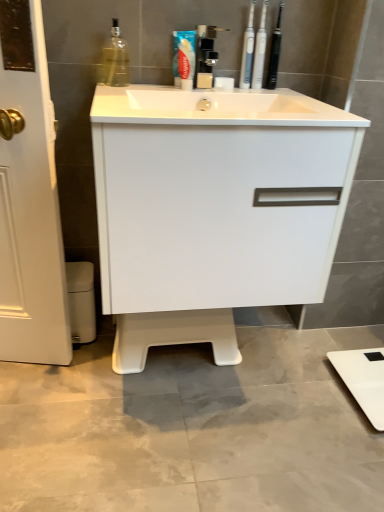
What is the approximate height of white glossy cabinet at center?

The height of white glossy cabinet at center is 22.76 inches.

Describe the element at coordinates (214, 209) in the screenshot. I see `white glossy cabinet at center` at that location.

The height and width of the screenshot is (512, 384). What do you see at coordinates (205, 55) in the screenshot?
I see `satin nickel faucet at upper center` at bounding box center [205, 55].

Describe the element at coordinates (275, 52) in the screenshot. The width and height of the screenshot is (384, 512). I see `black plastic toothbrushes at upper center, the first toiletry when ordered from right to left` at that location.

The image size is (384, 512). What do you see at coordinates (260, 50) in the screenshot?
I see `white plastic toothbrushes at upper center, which is the second toiletry in left-to-right order` at bounding box center [260, 50].

This screenshot has width=384, height=512. What do you see at coordinates (115, 59) in the screenshot? I see `translucent glass bottle at upper left` at bounding box center [115, 59].

The image size is (384, 512). Find the location of `white glossy sink at center`. white glossy sink at center is located at coordinates (215, 108).

Does white plastic toothbrushes at upper center, which is the second toiletry in left-to-right order, contain satin nickel faucet at upper center?

Definitely not — satin nickel faucet at upper center is not inside white plastic toothbrushes at upper center, which is the second toiletry in left-to-right order.

In the scene shown: Is white plastic toothbrushes at upper center, which is the second toiletry in left-to-right order, positioned far away from satin nickel faucet at upper center?

No.

From a real-world perspective, between white plastic toothbrushes at upper center, which is the second toiletry in left-to-right order, and satin nickel faucet at upper center, who is vertically lower?

satin nickel faucet at upper center, from a real-world perspective.

Considering the relative sizes of white plastic toothbrushes at upper center, which is the second toiletry in left-to-right order, and satin nickel faucet at upper center in the image provided, is white plastic toothbrushes at upper center, which is the second toiletry in left-to-right order, smaller than satin nickel faucet at upper center?

Indeed, white plastic toothbrushes at upper center, which is the second toiletry in left-to-right order, has a smaller size compared to satin nickel faucet at upper center.

Is white glossy sink at center aimed at white plastic toothbrushes at upper center, the 2th toiletry in the right-to-left sequence?

No, white glossy sink at center is not aimed at white plastic toothbrushes at upper center, the 2th toiletry in the right-to-left sequence.

Is the position of white glossy sink at center more distant than that of white plastic toothbrushes at upper center, which is the second toiletry in left-to-right order?

No, white glossy sink at center is in front of white plastic toothbrushes at upper center, which is the second toiletry in left-to-right order.

Between point (199, 98) and point (256, 81), which one is positioned behind?

The point (256, 81) is farther from the camera.

Measure the distance between white glossy sink at center and white plastic toothbrushes at upper center, which is the second toiletry in left-to-right order.

white glossy sink at center is 13.39 inches from white plastic toothbrushes at upper center, which is the second toiletry in left-to-right order.

In terms of height, does satin nickel faucet at upper center look taller or shorter compared to blue glossy toothpaste at upper center?

Clearly, satin nickel faucet at upper center is taller compared to blue glossy toothpaste at upper center.

Is satin nickel faucet at upper center further to camera compared to blue glossy toothpaste at upper center?

No, it is in front of blue glossy toothpaste at upper center.

You are a GUI agent. You are given a task and a screenshot of the screen. Output one action in this format:
    pyautogui.click(x=<x>, y=<y>)
    Task: Click on the toothpaste to the left of satin nickel faucet at upper center
    This screenshot has height=512, width=384.
    Given the screenshot: What is the action you would take?
    pyautogui.click(x=184, y=58)

How much distance is there between satin nickel faucet at upper center and blue glossy toothpaste at upper center?

They are 7.04 centimeters apart.

Is white plastic toothbrushes at upper right, which is the first toiletry from left to right, turned away from white glossy sink at center?

white plastic toothbrushes at upper right, which is the first toiletry from left to right, does not have its back to white glossy sink at center.

Which of these two, white plastic toothbrushes at upper right, which is the first toiletry from left to right, or white glossy sink at center, stands shorter?

With less height is white glossy sink at center.

Locate an element on the screen. Image resolution: width=384 pixels, height=512 pixels. counter top in front of the white plastic toothbrushes at upper right, which is the first toiletry from left to right is located at coordinates (215, 108).

Does white plastic toothbrushes at upper right, which is the first toiletry from left to right, appear on the right side of white glossy sink at center?

Correct, you'll find white plastic toothbrushes at upper right, which is the first toiletry from left to right, to the right of white glossy sink at center.

Is translucent glass bottle at upper left positioned before white plastic toothbrushes at upper right, placed as the third toiletry when sorted from right to left?

That is True.

Locate an element on the screen. bottle below the white plastic toothbrushes at upper right, placed as the third toiletry when sorted from right to left (from the image's perspective) is located at coordinates (115, 59).

Who is bigger, translucent glass bottle at upper left or white plastic toothbrushes at upper right, which is the first toiletry from left to right?

translucent glass bottle at upper left is bigger.

Looking at this image, considering the relative sizes of translucent glass bottle at upper left and white plastic toothbrushes at upper right, placed as the third toiletry when sorted from right to left, in the image provided, is translucent glass bottle at upper left thinner than white plastic toothbrushes at upper right, placed as the third toiletry when sorted from right to left,?

No.

Is satin nickel faucet at upper center positioned behind black plastic toothbrushes at upper center, the first toiletry when ordered from right to left?

No, satin nickel faucet at upper center is in front of black plastic toothbrushes at upper center, the first toiletry when ordered from right to left.

From a real-world perspective, relative to black plastic toothbrushes at upper center, which is the 3th toiletry from left to right, is satin nickel faucet at upper center vertically above or below?

From a real-world perspective, satin nickel faucet at upper center is physically below black plastic toothbrushes at upper center, which is the 3th toiletry from left to right.

Is satin nickel faucet at upper center next to black plastic toothbrushes at upper center, which is the 3th toiletry from left to right?

No, satin nickel faucet at upper center is not making contact with black plastic toothbrushes at upper center, which is the 3th toiletry from left to right.

From a real-world perspective, relative to black plastic toothbrushes at upper center, which is the 3th toiletry from left to right, is white glossy sink at center vertically above or below?

In terms of real-world spatial position, white glossy sink at center is below black plastic toothbrushes at upper center, which is the 3th toiletry from left to right.

Is white glossy sink at center taller or shorter than black plastic toothbrushes at upper center, the first toiletry when ordered from right to left?

white glossy sink at center is shorter than black plastic toothbrushes at upper center, the first toiletry when ordered from right to left.

Between white glossy sink at center and black plastic toothbrushes at upper center, which is the 3th toiletry from left to right, which one has smaller size?

black plastic toothbrushes at upper center, which is the 3th toiletry from left to right.

From the image's perspective, starting from the satin nickel faucet at upper center, which toiletry is the 2nd one above? Please provide its 2D coordinates.

[(260, 50)]

Locate an element on the screen. counter top that is under the white plastic toothbrushes at upper center, the 2th toiletry in the right-to-left sequence (from a real-world perspective) is located at coordinates (215, 108).

Which object lies further to the anchor point white glossy sink at center, white plastic toothbrushes at upper center, which is the second toiletry in left-to-right order, or satin nickel faucet at upper center?

Among the two, white plastic toothbrushes at upper center, which is the second toiletry in left-to-right order, is located further to white glossy sink at center.

Which object lies further to the anchor point satin nickel faucet at upper center, blue glossy toothpaste at upper center or black plastic toothbrushes at upper center, which is the 3th toiletry from left to right?

Based on the image, black plastic toothbrushes at upper center, which is the 3th toiletry from left to right, appears to be further to satin nickel faucet at upper center.

Estimate the real-world distances between objects in this image. Which object is further from white plastic toothbrushes at upper right, which is the first toiletry from left to right, translucent glass bottle at upper left or white plastic toothbrushes at upper center, the 2th toiletry in the right-to-left sequence?

translucent glass bottle at upper left is positioned further to the anchor white plastic toothbrushes at upper right, which is the first toiletry from left to right.

Looking at the image, which one is located further to white plastic toothbrushes at upper center, which is the second toiletry in left-to-right order, blue glossy toothpaste at upper center or black plastic toothbrushes at upper center, the first toiletry when ordered from right to left?

blue glossy toothpaste at upper center is further to white plastic toothbrushes at upper center, which is the second toiletry in left-to-right order.

Based on their spatial positions, is blue glossy toothpaste at upper center or white glossy cabinet at center further from translucent glass bottle at upper left?

Based on the image, white glossy cabinet at center appears to be further to translucent glass bottle at upper left.

Estimate the real-world distances between objects in this image. Which object is closer to white glossy cabinet at center, translucent glass bottle at upper left or black plastic toothbrushes at upper center, the first toiletry when ordered from right to left?

translucent glass bottle at upper left lies closer to white glossy cabinet at center than the other object.

Based on their spatial positions, is blue glossy toothpaste at upper center or translucent glass bottle at upper left further from white glossy cabinet at center?

Based on the image, translucent glass bottle at upper left appears to be further to white glossy cabinet at center.

Looking at the image, which one is located closer to satin nickel faucet at upper center, white plastic toothbrushes at upper right, which is the first toiletry from left to right, or white plastic toothbrushes at upper center, which is the second toiletry in left-to-right order?

white plastic toothbrushes at upper right, which is the first toiletry from left to right, is positioned closer to the anchor satin nickel faucet at upper center.

Where is `counter top between white plastic toothbrushes at upper center, the 2th toiletry in the right-to-left sequence, and white glossy cabinet at center vertically`? The image size is (384, 512). counter top between white plastic toothbrushes at upper center, the 2th toiletry in the right-to-left sequence, and white glossy cabinet at center vertically is located at coordinates (215, 108).

This screenshot has height=512, width=384. In order to click on toothpaste located between white glossy sink at center and black plastic toothbrushes at upper center, which is the 3th toiletry from left to right, in the depth direction in this screenshot , I will do `click(184, 58)`.

Image resolution: width=384 pixels, height=512 pixels. What are the coordinates of `toothpaste positioned between white glossy sink at center and white plastic toothbrushes at upper right, which is the first toiletry from left to right, from near to far` in the screenshot? It's located at (184, 58).

Identify the location of counter top between white plastic toothbrushes at upper right, which is the first toiletry from left to right, and white glossy cabinet at center in the up-down direction. (215, 108).